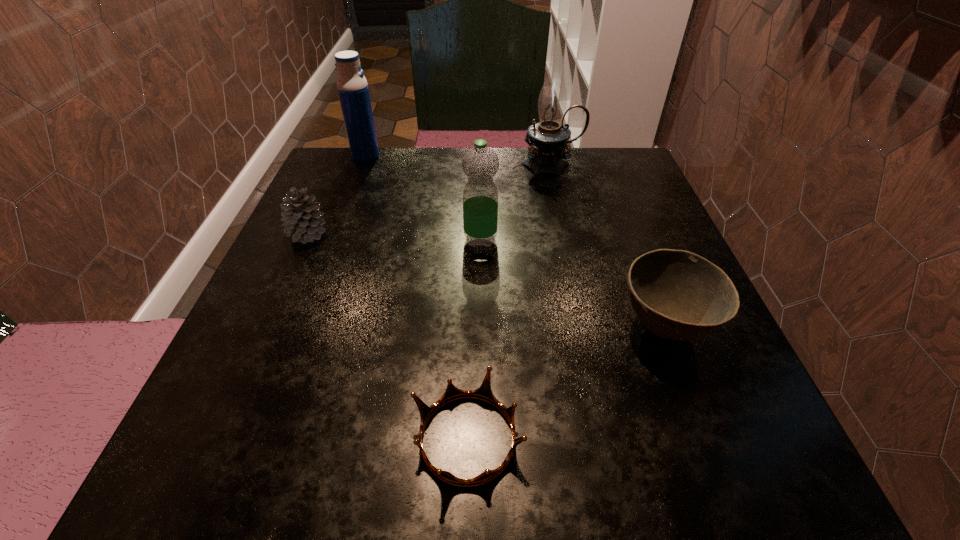
Locate an element on the screen. The image size is (960, 540). free space located 0.340m on the right of the shorter water bottle is located at coordinates (671, 239).

In order to click on blank space located 0.340m on the right of the pinecone in this screenshot , I will do coord(500,234).

Locate an element on the screen. The width and height of the screenshot is (960, 540). vacant space situated on the back of the bowl is located at coordinates (620, 214).

Where is `vacant area situated 0.370m on the back of the crown`? vacant area situated 0.370m on the back of the crown is located at coordinates (472, 228).

You are a GUI agent. You are given a task and a screenshot of the screen. Output one action in this format:
    pyautogui.click(x=<x>, y=<y>)
    Task: Click on the oil lamp that is at the far edge
    The height and width of the screenshot is (540, 960).
    Given the screenshot: What is the action you would take?
    pyautogui.click(x=548, y=139)

Find the location of `water bottle located at the far edge`. water bottle located at the far edge is located at coordinates (352, 86).

Locate an element on the screen. This screenshot has width=960, height=540. object present at the near edge is located at coordinates (484, 392).

Identify the location of water bottle that is at the left edge. Image resolution: width=960 pixels, height=540 pixels. (352, 86).

The height and width of the screenshot is (540, 960). Find the location of `pinecone that is at the left edge`. pinecone that is at the left edge is located at coordinates (302, 221).

This screenshot has height=540, width=960. I want to click on oil lamp located in the right edge section of the desktop, so click(548, 139).